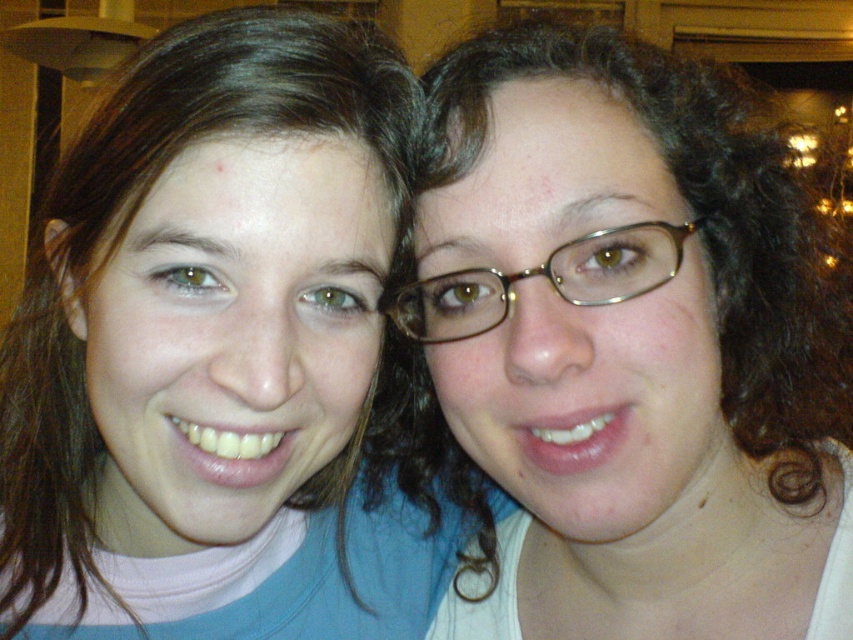
You are taking a photo of two people. You notice the matte pink shirt at left and the gold metallic glasses at center. Which object is positioned lower in the image?

The matte pink shirt at left is positioned below the gold metallic glasses at center, so it is lower in the image.